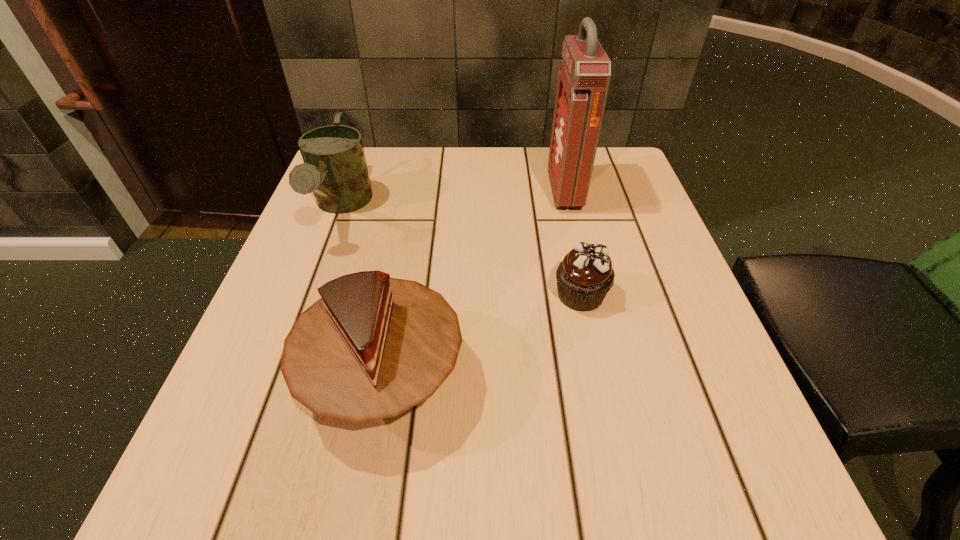
Where is `vacant area that lies between the cupcake and the watering can`? This screenshot has height=540, width=960. vacant area that lies between the cupcake and the watering can is located at coordinates (461, 251).

The height and width of the screenshot is (540, 960). What are the coordinates of `object that is the third closest to the tallest object` in the screenshot? It's located at (335, 169).

The image size is (960, 540). Identify the location of object that ranks as the second closest to the watering can. (584, 277).

This screenshot has height=540, width=960. I want to click on free location that satisfies the following two spatial constraints: 1. with the spout on the cake; 2. on the left side of the watering can, so click(x=277, y=377).

Where is `free spot that satisfies the following two spatial constraints: 1. with the spout on the watering can; 2. on the left side of the cake`? This screenshot has height=540, width=960. free spot that satisfies the following two spatial constraints: 1. with the spout on the watering can; 2. on the left side of the cake is located at coordinates (277, 377).

The width and height of the screenshot is (960, 540). Find the location of `vacant space that satisfies the following two spatial constraints: 1. on the front-facing side of the first-aid kit; 2. on the front side of the cake`. vacant space that satisfies the following two spatial constraints: 1. on the front-facing side of the first-aid kit; 2. on the front side of the cake is located at coordinates (609, 377).

Where is `vacant space that satisfies the following two spatial constraints: 1. with the spout on the watering can; 2. on the left side of the cake`? Image resolution: width=960 pixels, height=540 pixels. vacant space that satisfies the following two spatial constraints: 1. with the spout on the watering can; 2. on the left side of the cake is located at coordinates (277, 377).

This screenshot has width=960, height=540. I want to click on vacant region that satisfies the following two spatial constraints: 1. with the spout on the watering can; 2. on the left side of the cupcake, so click(308, 295).

The width and height of the screenshot is (960, 540). Identify the location of blank area in the image that satisfies the following two spatial constraints: 1. with the spout on the watering can; 2. on the right side of the cupcake. [308, 295].

This screenshot has height=540, width=960. Identify the location of free space in the image that satisfies the following two spatial constraints: 1. with the spout on the watering can; 2. on the right side of the shortest object. (308, 295).